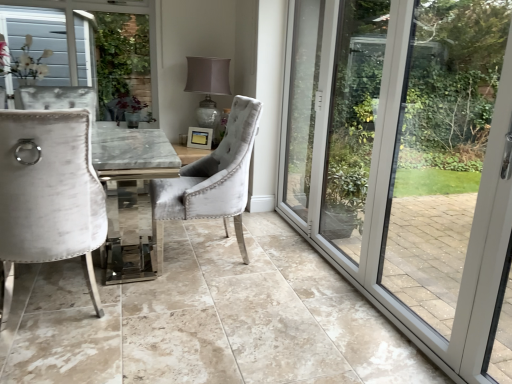
What do you see at coordinates (48, 193) in the screenshot? I see `velvet white chair at left, acting as the second chair starting from the right` at bounding box center [48, 193].

What is the approximate height of velvet white chair at left, acting as the second chair starting from the right?

1.03 meters.

The height and width of the screenshot is (384, 512). Find the location of `white textured fabric at upper left`. white textured fabric at upper left is located at coordinates (38, 38).

Is the depth of matte silver lamp at center greater than that of transparent glass door at right?

Yes, matte silver lamp at center is further from the camera.

Between point (192, 77) and point (372, 98), which one is positioned in front?

The point (372, 98) is in front.

Looking at this image, which object is positioned more to the right, matte silver lamp at center or transparent glass door at right?

transparent glass door at right is more to the right.

This screenshot has height=384, width=512. I want to click on lamp on the left of transparent glass door at right, so click(x=208, y=87).

Is transparent glass door at right at the back of velvet grey chair at center, acting as the second chair starting from the left?

Yes.

Based on the photo, considering the positions of objects velvet grey chair at center, acting as the second chair starting from the left, and transparent glass door at right in the image provided, who is in front, velvet grey chair at center, acting as the second chair starting from the left, or transparent glass door at right?

transparent glass door at right is more forward.

From the image's perspective, who appears lower, velvet grey chair at center, which is counted as the first chair, starting from the right, or transparent glass door at right?

velvet grey chair at center, which is counted as the first chair, starting from the right, from the image's perspective.

Looking at this image, is matte silver lamp at center taller or shorter than white textured fabric at upper left?

Clearly, matte silver lamp at center is taller compared to white textured fabric at upper left.

Is matte silver lamp at center bigger than white textured fabric at upper left?

Yes, matte silver lamp at center is bigger than white textured fabric at upper left.

From a real-world perspective, which object stands above the other?

white textured fabric at upper left is physically above.

Can you confirm if matte silver lamp at center is wider than white textured fabric at upper left?

Yes.

Which object is thinner, velvet grey chair at center, acting as the second chair starting from the left, or velvet white chair at left, placed as the 1th chair when sorted from left to right?

velvet white chair at left, placed as the 1th chair when sorted from left to right.

How much distance is there between velvet grey chair at center, acting as the second chair starting from the left, and velvet white chair at left, acting as the second chair starting from the right?

A distance of 28.50 inches exists between velvet grey chair at center, acting as the second chair starting from the left, and velvet white chair at left, acting as the second chair starting from the right.

Considering their positions, is velvet grey chair at center, which is counted as the first chair, starting from the right, located in front of or behind velvet white chair at left, acting as the second chair starting from the right?

In the image, velvet grey chair at center, which is counted as the first chair, starting from the right, appears behind velvet white chair at left, acting as the second chair starting from the right.

Where is `chair to the right of velvet white chair at left, acting as the second chair starting from the right`? The height and width of the screenshot is (384, 512). chair to the right of velvet white chair at left, acting as the second chair starting from the right is located at coordinates (211, 180).

In terms of height, does white textured fabric at upper left look taller or shorter compared to velvet grey chair at center, which is counted as the first chair, starting from the right?

Considering their sizes, white textured fabric at upper left has less height than velvet grey chair at center, which is counted as the first chair, starting from the right.

The width and height of the screenshot is (512, 384). I want to click on window screen that appears above the velvet grey chair at center, which is counted as the first chair, starting from the right (from the image's perspective), so click(x=38, y=38).

Does white textured fabric at upper left contain velvet grey chair at center, which is counted as the first chair, starting from the right?

No, white textured fabric at upper left does not contain velvet grey chair at center, which is counted as the first chair, starting from the right.

Looking at this image, is white textured fabric at upper left turned away from velvet grey chair at center, acting as the second chair starting from the left?

white textured fabric at upper left is not turned away from velvet grey chair at center, acting as the second chair starting from the left.

Does point (78, 225) lie behind point (244, 127)?

No, it is not.

From a real-world perspective, who is located higher, velvet white chair at left, acting as the second chair starting from the right, or velvet grey chair at center, which is counted as the first chair, starting from the right?

velvet grey chair at center, which is counted as the first chair, starting from the right, is physically above.

Does velvet white chair at left, placed as the 1th chair when sorted from left to right, come in front of velvet grey chair at center, which is counted as the first chair, starting from the right?

That is True.

Which of these two, transparent glass door at right or matte silver lamp at center, is thinner?

With smaller width is transparent glass door at right.

From the image's perspective, is transparent glass door at right under matte silver lamp at center?

Yes, from the image's perspective, transparent glass door at right is beneath matte silver lamp at center.

Find the location of a particular element. The width and height of the screenshot is (512, 384). door on the right of matte silver lamp at center is located at coordinates (406, 162).

Where is `door in front of the velvet grey chair at center, acting as the second chair starting from the left`? This screenshot has height=384, width=512. door in front of the velvet grey chair at center, acting as the second chair starting from the left is located at coordinates (406, 162).

Which object lies nearer to the anchor point velvet white chair at left, placed as the 1th chair when sorted from left to right, matte silver lamp at center or velvet grey chair at center, acting as the second chair starting from the left?

velvet grey chair at center, acting as the second chair starting from the left, lies closer to velvet white chair at left, placed as the 1th chair when sorted from left to right, than the other object.

Estimate the real-world distances between objects in this image. Which object is closer to matte silver lamp at center, velvet grey chair at center, acting as the second chair starting from the left, or white textured fabric at upper left?

velvet grey chair at center, acting as the second chair starting from the left.

From the image, which object appears to be farther from white textured fabric at upper left, matte silver lamp at center or velvet grey chair at center, acting as the second chair starting from the left?

velvet grey chair at center, acting as the second chair starting from the left, is further to white textured fabric at upper left.

From the image, which object appears to be farther from white textured fabric at upper left, matte silver lamp at center or velvet white chair at left, placed as the 1th chair when sorted from left to right?

Among the two, velvet white chair at left, placed as the 1th chair when sorted from left to right, is located further to white textured fabric at upper left.

Based on their spatial positions, is white textured fabric at upper left or velvet white chair at left, acting as the second chair starting from the right, further from velvet grey chair at center, acting as the second chair starting from the left?

Based on the image, white textured fabric at upper left appears to be further to velvet grey chair at center, acting as the second chair starting from the left.

Based on their spatial positions, is white textured fabric at upper left or matte silver lamp at center further from velvet grey chair at center, acting as the second chair starting from the left?

The object further to velvet grey chair at center, acting as the second chair starting from the left, is white textured fabric at upper left.

Consider the image. When comparing their distances from velvet white chair at left, placed as the 1th chair when sorted from left to right, does velvet grey chair at center, which is counted as the first chair, starting from the right, or matte silver lamp at center seem closer?

The object closer to velvet white chair at left, placed as the 1th chair when sorted from left to right, is velvet grey chair at center, which is counted as the first chair, starting from the right.

Which object lies nearer to the anchor point white textured fabric at upper left, velvet white chair at left, placed as the 1th chair when sorted from left to right, or velvet grey chair at center, which is counted as the first chair, starting from the right?

velvet grey chair at center, which is counted as the first chair, starting from the right, lies closer to white textured fabric at upper left than the other object.

Locate an element on the screen. The image size is (512, 384). chair positioned between velvet white chair at left, placed as the 1th chair when sorted from left to right, and matte silver lamp at center from near to far is located at coordinates (211, 180).

Identify the location of chair between velvet white chair at left, placed as the 1th chair when sorted from left to right, and transparent glass door at right. The width and height of the screenshot is (512, 384). (211, 180).

At what (x,y) coordinates should I click in order to perform the action: click on lamp situated between white textured fabric at upper left and velvet grey chair at center, acting as the second chair starting from the left, from left to right. Please return your answer as a coordinate pair (x, y). Looking at the image, I should click on (208, 87).

Find the location of `chair between velvet white chair at left, placed as the 1th chair when sorted from left to right, and white textured fabric at upper left, along the z-axis`. chair between velvet white chair at left, placed as the 1th chair when sorted from left to right, and white textured fabric at upper left, along the z-axis is located at coordinates (211, 180).